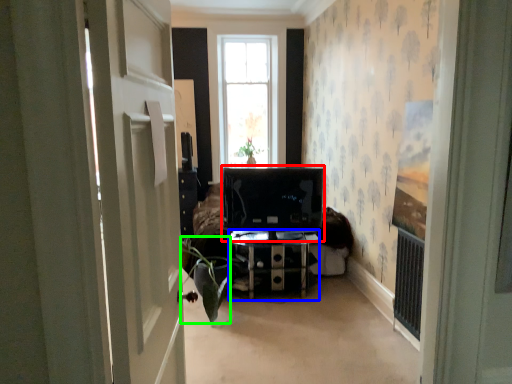
Question: Considering the real-world distances, which object is closest to computer monitor (highlighted by a red box)? furniture (highlighted by a blue box) or plant (highlighted by a green box).

Choices:
 (A) furniture
 (B) plant

Answer: (A)